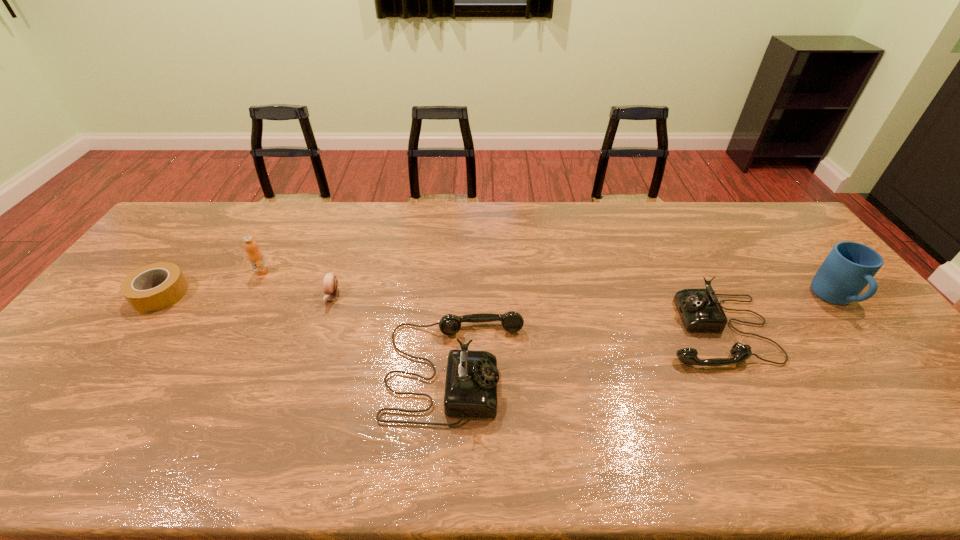
The image size is (960, 540). I want to click on free region located on the dial of the shorter telephone, so click(x=542, y=329).

Where is `blank space located 0.150m on the dial of the shorter telephone`? This screenshot has height=540, width=960. blank space located 0.150m on the dial of the shorter telephone is located at coordinates (608, 329).

This screenshot has width=960, height=540. I want to click on free space located 0.280m on the dial of the shorter telephone, so click(x=561, y=329).

At what (x,y) coordinates should I click in order to perform the action: click on free spot located on the front label of the farthest object. Please return your answer as a coordinate pair (x, y). Looking at the image, I should click on (209, 368).

Locate an element on the screen. This screenshot has height=540, width=960. free spot located on the front-facing side of the third object from left to right is located at coordinates (290, 416).

Find the location of a particular element. The width and height of the screenshot is (960, 540). vacant space situated 0.210m at the edge of the leftmost object is located at coordinates (x=98, y=377).

Where is `vacant space situated on the side of the mug with the handle`? This screenshot has height=540, width=960. vacant space situated on the side of the mug with the handle is located at coordinates (930, 417).

What are the coordinates of `object located at the near edge` in the screenshot? It's located at (471, 381).

At what (x,y) coordinates should I click in order to perform the action: click on object that is positioned at the left edge. Please return your answer as a coordinate pair (x, y). This screenshot has height=540, width=960. Looking at the image, I should click on (135, 288).

Find the location of a particular element. Image resolution: width=960 pixels, height=540 pixels. object that is at the right edge is located at coordinates (850, 266).